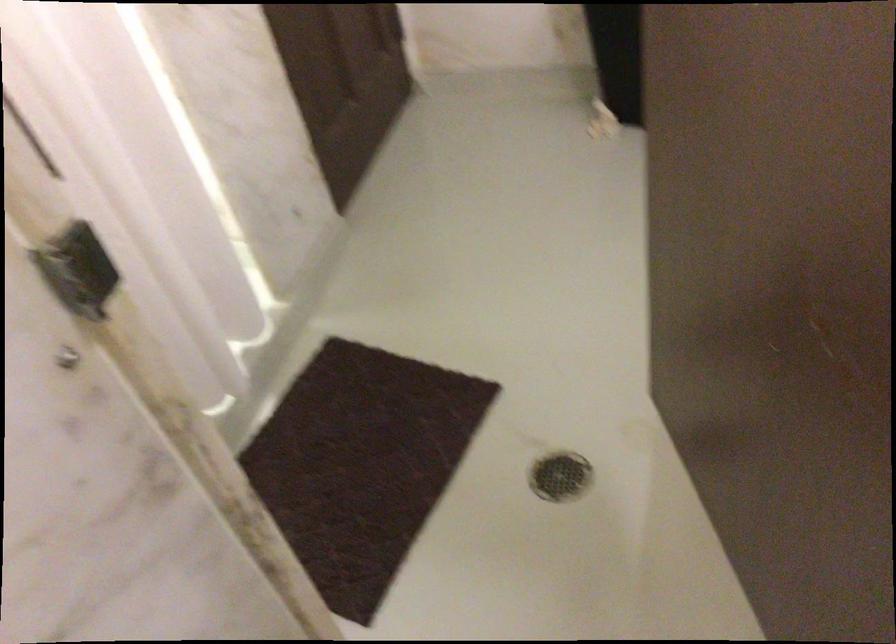
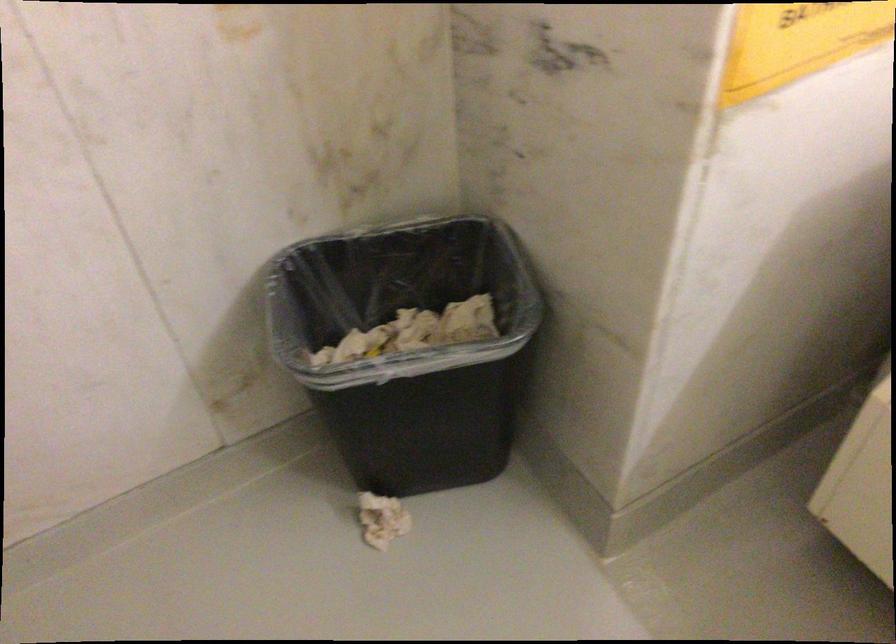
The point at (595, 126) is marked in the first image. Where is the corresponding point in the second image?

(382, 520)